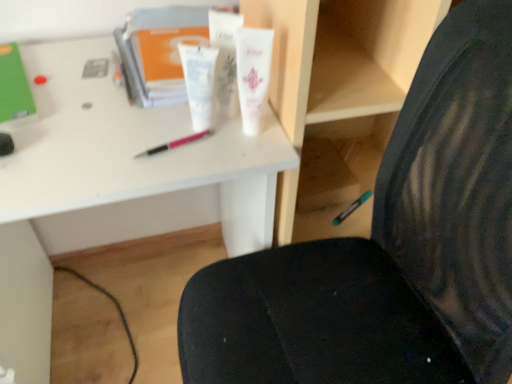
Locate an element on the screen. This screenshot has height=384, width=512. vacant area that is situated to the right of green matte folder at upper left, the second stationery from the back is located at coordinates (73, 106).